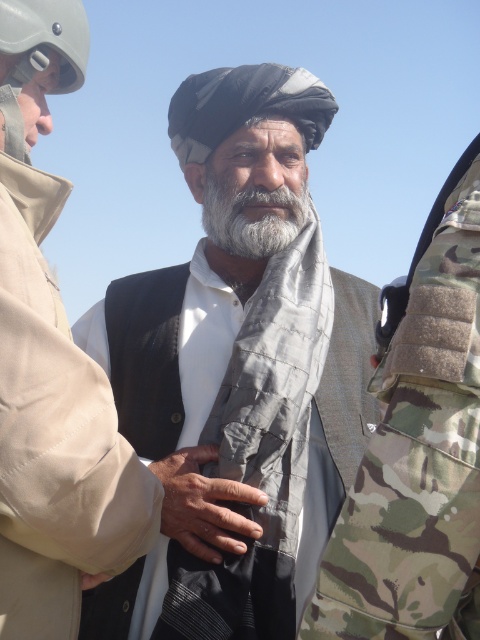
What is the significance of the point marked at coordinates (204, 504) in the scene?

The point at coordinates (204, 504) marks the location of dry skin at the center of the scene.

What is the position of the gray quilted scarf at center in the image?

The gray quilted scarf at center is located at point (239, 358).